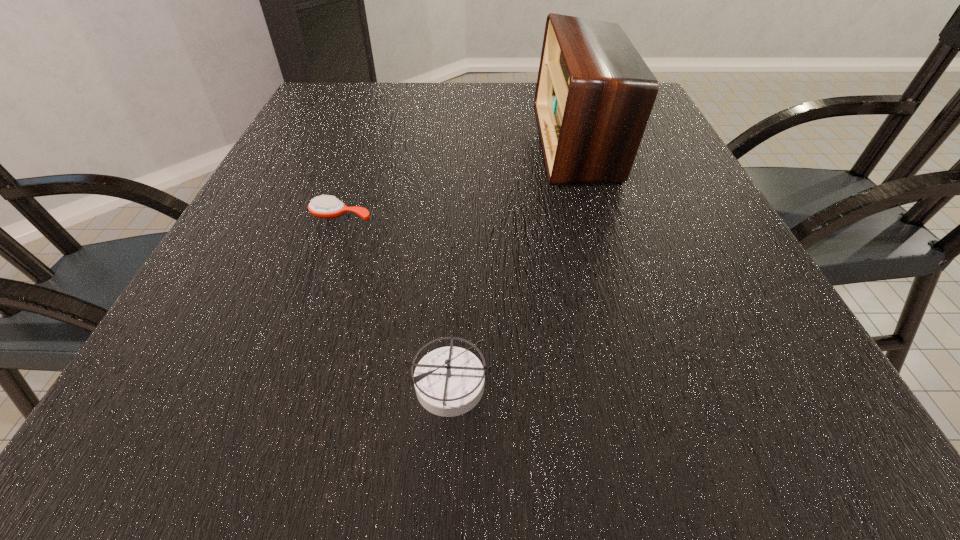
Where is `vacant position located on the front of the second farthest object`? Image resolution: width=960 pixels, height=540 pixels. vacant position located on the front of the second farthest object is located at coordinates (311, 303).

The width and height of the screenshot is (960, 540). In order to click on object present at the far edge in this screenshot , I will do `click(594, 95)`.

Where is `object that is positioned at the near edge`? This screenshot has width=960, height=540. object that is positioned at the near edge is located at coordinates (449, 381).

The height and width of the screenshot is (540, 960). Find the location of `object at the left edge`. object at the left edge is located at coordinates (327, 207).

Where is `object located at the right edge`? The image size is (960, 540). object located at the right edge is located at coordinates (594, 95).

The height and width of the screenshot is (540, 960). I want to click on object at the far right corner, so point(594,95).

Where is `vacant area at the far edge of the desktop`? The height and width of the screenshot is (540, 960). vacant area at the far edge of the desktop is located at coordinates (424, 114).

In the image, there is a desktop. Where is `vacant area at the near edge`? Image resolution: width=960 pixels, height=540 pixels. vacant area at the near edge is located at coordinates (278, 427).

Identify the location of blank space at the left edge of the desktop. pos(354,131).

Where is `vacant area at the right edge of the desktop`? The width and height of the screenshot is (960, 540). vacant area at the right edge of the desktop is located at coordinates coord(779,315).